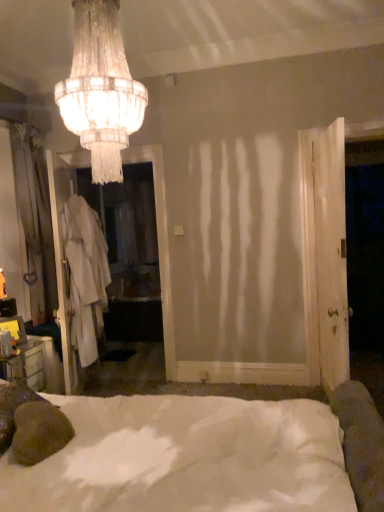
Question: From a real-world perspective, is white soft bed at center located beneath white wood door at right?

Choices:
 (A) no
 (B) yes

Answer: (B)

Question: Can you see white soft bed at center touching white wood door at right?

Choices:
 (A) no
 (B) yes

Answer: (A)

Question: Can you confirm if white soft bed at center is taller than white wood door at right?

Choices:
 (A) no
 (B) yes

Answer: (A)

Question: Does white soft bed at center appear on the right side of white wood door at right?

Choices:
 (A) no
 (B) yes

Answer: (A)

Question: From the image's perspective, is white soft bed at center on top of white wood door at right?

Choices:
 (A) yes
 (B) no

Answer: (B)

Question: From a real-world perspective, is white soft bed at center positioned over white wood door at right based on gravity?

Choices:
 (A) yes
 (B) no

Answer: (B)

Question: Would you say crystal glass chandelier at upper center contains white fabric robe at left?

Choices:
 (A) no
 (B) yes

Answer: (A)

Question: From the image's perspective, is crystal glass chandelier at upper center under white fabric robe at left?

Choices:
 (A) yes
 (B) no

Answer: (B)

Question: Would you consider crystal glass chandelier at upper center to be distant from white fabric robe at left?

Choices:
 (A) no
 (B) yes

Answer: (B)

Question: Can you confirm if crystal glass chandelier at upper center is taller than white fabric robe at left?

Choices:
 (A) yes
 (B) no

Answer: (B)

Question: Is crystal glass chandelier at upper center shorter than white fabric robe at left?

Choices:
 (A) yes
 (B) no

Answer: (A)

Question: Does crystal glass chandelier at upper center appear on the right side of white fabric robe at left?

Choices:
 (A) no
 (B) yes

Answer: (B)

Question: From a real-world perspective, is white wood door at right on top of white fabric robe at left?

Choices:
 (A) no
 (B) yes

Answer: (B)